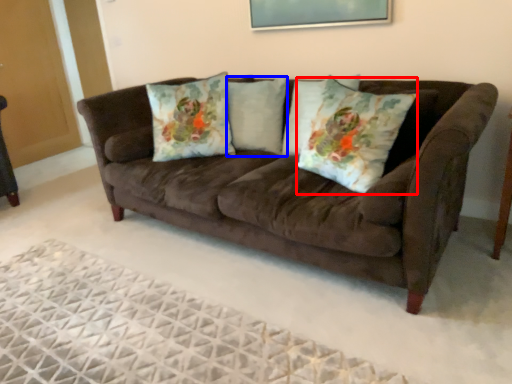
Question: Which point is closer to the camera, throw pillow (highlighted by a red box) or pillow (highlighted by a blue box)?

Choices:
 (A) throw pillow
 (B) pillow

Answer: (A)